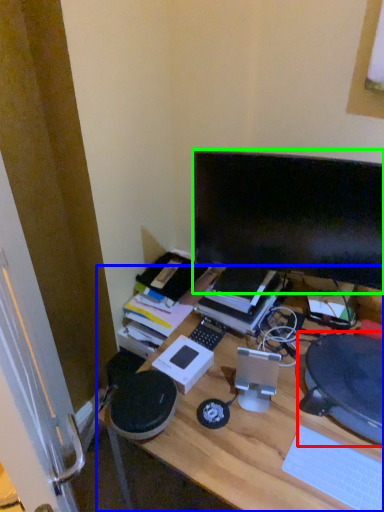
Question: Which object is positioned closest to computer chair (highlighted by a red box)? Select from desk (highlighted by a blue box) and computer monitor (highlighted by a green box).

Choices:
 (A) desk
 (B) computer monitor

Answer: (A)